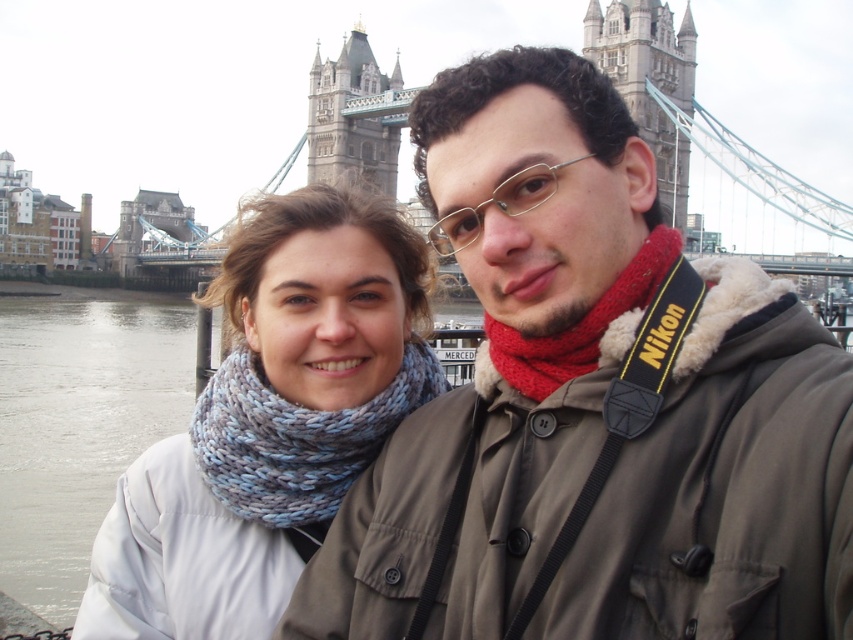
Question: Is matte khaki jacket at center thinner than blue knitted scarf at left?

Choices:
 (A) no
 (B) yes

Answer: (A)

Question: Can you confirm if blue knitted scarf at center is smaller than stone gray tower bridge at upper center?

Choices:
 (A) no
 (B) yes

Answer: (A)

Question: Which point is farther to the camera?

Choices:
 (A) (10, 497)
 (B) (485, 323)
 (C) (370, 116)

Answer: (C)

Question: Is blue knitted scarf at center positioned at the back of stone gray tower bridge at upper center?

Choices:
 (A) no
 (B) yes

Answer: (A)

Question: Which object is positioned farthest from the blue knitted scarf at center?

Choices:
 (A) matte khaki jacket at center
 (B) white fabric at lower left

Answer: (B)

Question: Which of these objects is positioned closest to the matte khaki jacket at center?

Choices:
 (A) blue knitted scarf at left
 (B) stone gray tower bridge at upper center

Answer: (A)